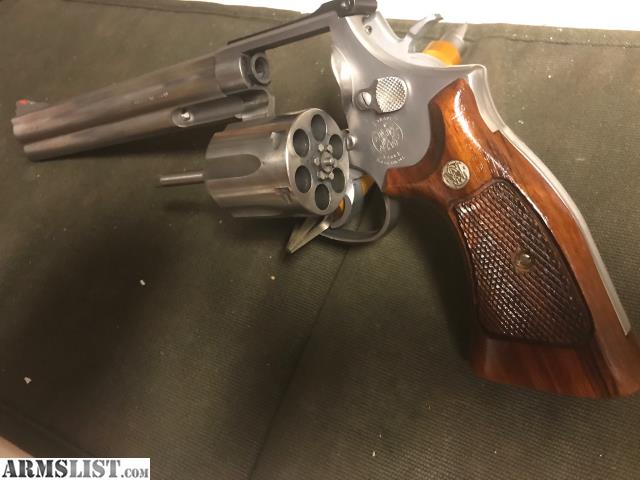
At what (x,y) coordinates should I click in order to perform the action: click on chamber. Please return your answer as a coordinate pair (x, y). Looking at the image, I should click on (322, 155).